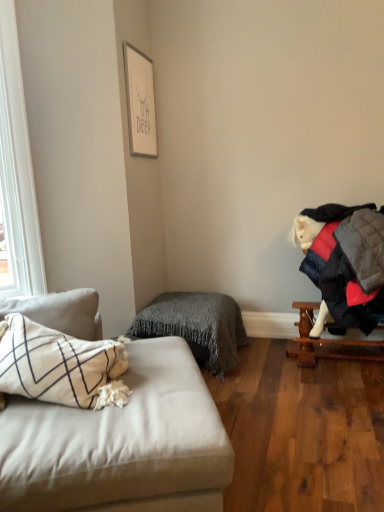
Question: Is the depth of wooden table at right greater than that of white matte picture frame at upper center?

Choices:
 (A) yes
 (B) no

Answer: (B)

Question: Does wooden table at right turn towards white matte picture frame at upper center?

Choices:
 (A) yes
 (B) no

Answer: (B)

Question: Is wooden table at right not near white matte picture frame at upper center?

Choices:
 (A) yes
 (B) no

Answer: (A)

Question: From the image's perspective, is wooden table at right under white matte picture frame at upper center?

Choices:
 (A) no
 (B) yes

Answer: (B)

Question: Can you confirm if wooden table at right is taller than white matte picture frame at upper center?

Choices:
 (A) yes
 (B) no

Answer: (B)

Question: Is wooden table at right inside the boundaries of gray fuzzy blanket at center, or outside?

Choices:
 (A) outside
 (B) inside

Answer: (A)

Question: In terms of width, does wooden table at right look wider or thinner when compared to gray fuzzy blanket at center?

Choices:
 (A) wide
 (B) thin

Answer: (B)

Question: Considering the relative positions of wooden table at right and gray fuzzy blanket at center in the image provided, is wooden table at right to the left or to the right of gray fuzzy blanket at center?

Choices:
 (A) right
 (B) left

Answer: (A)

Question: From the image's perspective, relative to gray fuzzy blanket at center, is wooden table at right above or below?

Choices:
 (A) below
 (B) above

Answer: (A)

Question: Is point 233,362 positioned closer to the camera than point 28,506?

Choices:
 (A) closer
 (B) farther

Answer: (B)

Question: In terms of width, does gray fuzzy blanket at center look wider or thinner when compared to light gray fabric studio couch at left?

Choices:
 (A) wide
 (B) thin

Answer: (B)

Question: Relative to light gray fabric studio couch at left, is gray fuzzy blanket at center in front or behind?

Choices:
 (A) behind
 (B) front

Answer: (A)

Question: Which is correct: gray fuzzy blanket at center is inside light gray fabric studio couch at left, or outside of it?

Choices:
 (A) outside
 (B) inside

Answer: (A)

Question: From a real-world perspective, relative to light gray fabric studio couch at left, is white matte picture frame at upper center vertically above or below?

Choices:
 (A) above
 (B) below

Answer: (A)

Question: Considering their positions, is white matte picture frame at upper center located in front of or behind light gray fabric studio couch at left?

Choices:
 (A) front
 (B) behind

Answer: (B)